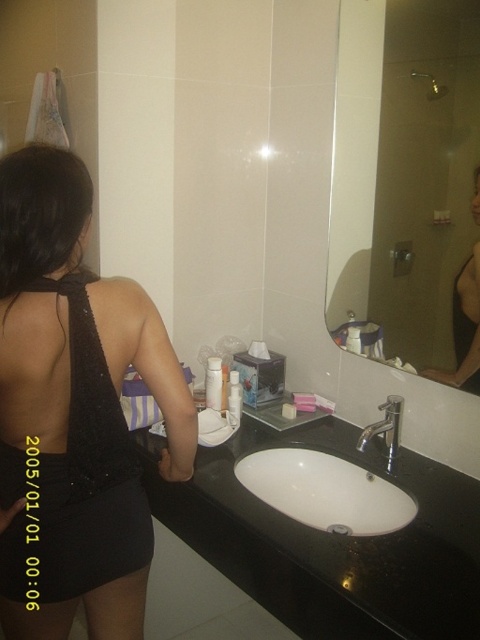
Question: Which point is closer to the camera?

Choices:
 (A) (84, 560)
 (B) (455, 330)
 (C) (227, 371)

Answer: (A)

Question: Estimate the real-world distances between objects in this image. Which object is closer to the matte black tank top at upper center?

Choices:
 (A) black sequined dress at left
 (B) white glossy sink at center
 (C) silver metallic faucet at center

Answer: (C)

Question: Is matte black tank top at upper center closer to the viewer compared to white matte tissue box at upper center?

Choices:
 (A) no
 (B) yes

Answer: (B)

Question: Is black sequined dress at left thinner than silver metallic faucet at center?

Choices:
 (A) yes
 (B) no

Answer: (B)

Question: Is silver metallic faucet at center bigger than white matte tissue box at upper center?

Choices:
 (A) yes
 (B) no

Answer: (A)

Question: Which of the following is the farthest from the observer?

Choices:
 (A) (213, 401)
 (B) (347, 104)

Answer: (A)